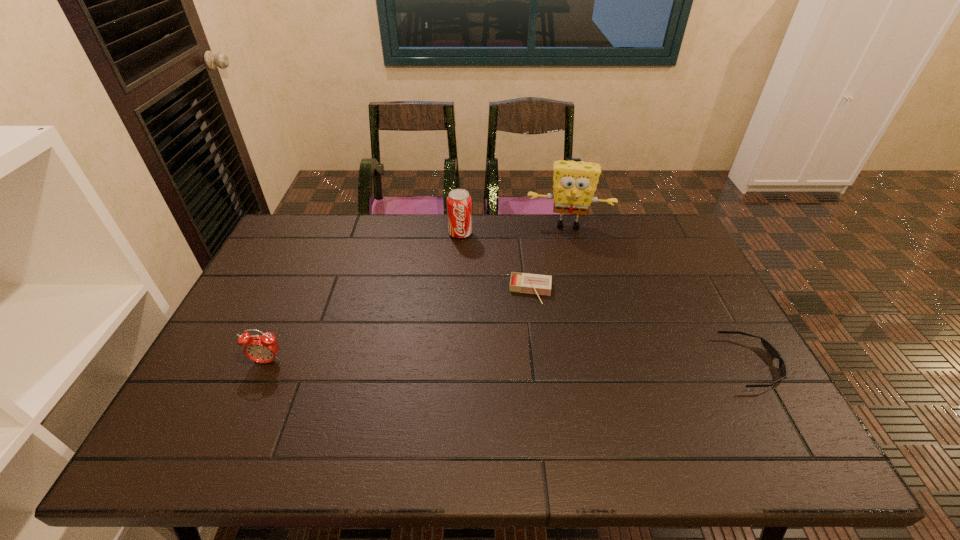
Locate an element on the screen. free space between the sunglasses and the tallest object is located at coordinates (660, 294).

Find the location of a particular element. empty location between the matchbox and the sponge is located at coordinates (549, 258).

The height and width of the screenshot is (540, 960). I want to click on vacant space in between the matchbox and the rightmost object, so click(x=642, y=327).

Image resolution: width=960 pixels, height=540 pixels. I want to click on empty space that is in between the third farthest object and the tallest object, so click(549, 258).

Locate an element on the screen. The image size is (960, 540). free space between the rightmost object and the second object from left to right is located at coordinates (607, 298).

This screenshot has height=540, width=960. I want to click on vacant space that is in between the fourth tallest object and the tallest object, so click(x=549, y=258).

You are a GUI agent. You are given a task and a screenshot of the screen. Output one action in this format:
    pyautogui.click(x=<x>, y=<y>)
    Task: Click on the free space between the soda can and the rightmost object
    
    Given the screenshot: What is the action you would take?
    pyautogui.click(x=607, y=298)

The image size is (960, 540). Find the location of `vacant space that's between the shortest object and the alarm clock`. vacant space that's between the shortest object and the alarm clock is located at coordinates (510, 362).

Where is `empty location between the tallest object and the third tallest object`? This screenshot has height=540, width=960. empty location between the tallest object and the third tallest object is located at coordinates (418, 293).

Locate an element on the screen. Image resolution: width=960 pixels, height=540 pixels. object that is the closest one to the third shortest object is located at coordinates (537, 284).